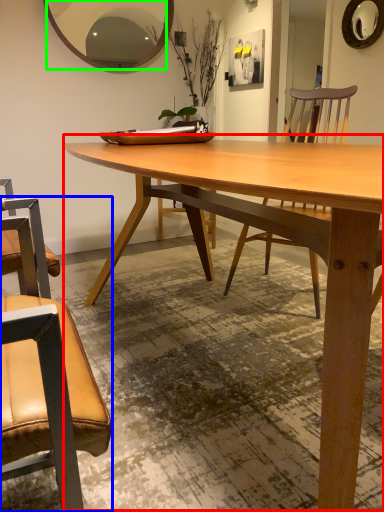
Question: Based on their relative distances, which object is nearer to coffee table (highlighted by a red box)? Choose from chair (highlighted by a blue box) and mirror (highlighted by a green box).

Choices:
 (A) chair
 (B) mirror

Answer: (A)